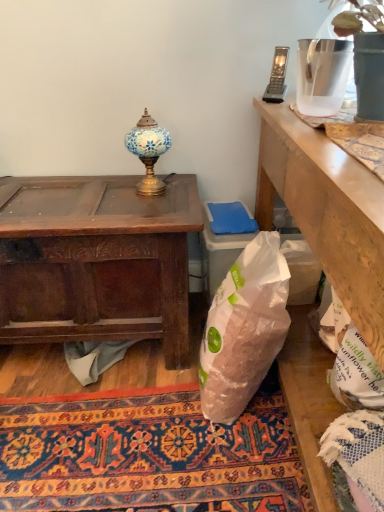
Where is `free location above carpeted rug at center (from a real-world perspective)`? Image resolution: width=384 pixels, height=512 pixels. free location above carpeted rug at center (from a real-world perspective) is located at coordinates (115, 404).